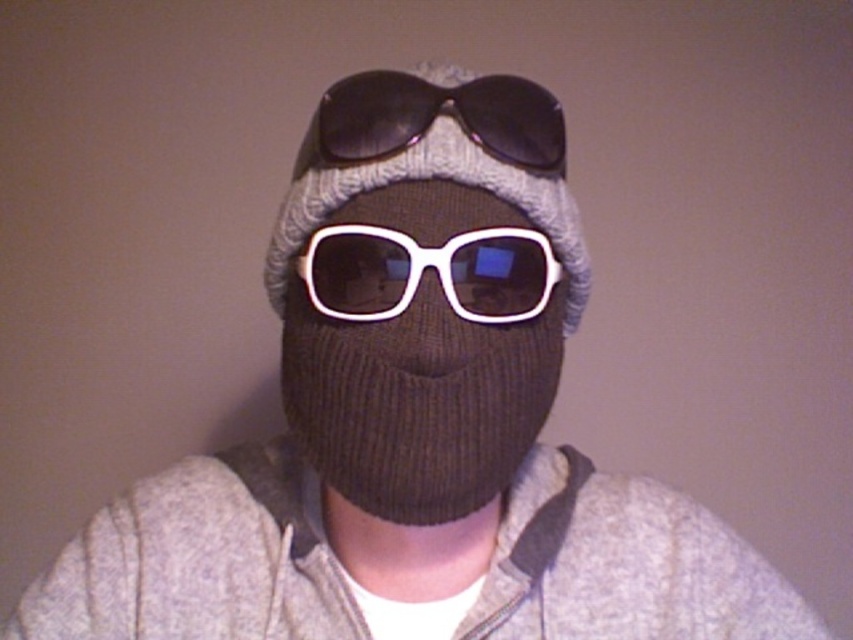
Can you confirm if sunglasses at center is positioned to the right of knitted gray hat at center?

No, sunglasses at center is not to the right of knitted gray hat at center.

Does sunglasses at center have a smaller size compared to knitted gray hat at center?

Correct, sunglasses at center occupies less space than knitted gray hat at center.

Does point (444, 90) lie in front of point (296, 204)?

Yes.

Find the location of a particular element. The width and height of the screenshot is (853, 640). sunglasses at center is located at coordinates (433, 120).

Find the location of `white matte sunglasses at center`. white matte sunglasses at center is located at coordinates (416, 403).

Based on the photo, which of these two, white matte sunglasses at center or knitted gray hat at center, stands taller?

With more height is white matte sunglasses at center.

Is point (310, 353) positioned behind point (560, 209)?

That is False.

The height and width of the screenshot is (640, 853). Identify the location of white matte sunglasses at center. (416, 403).

Which is behind, point (378, 305) or point (405, 140)?

Point (405, 140)

What do you see at coordinates (425, 269) in the screenshot? I see `white plastic sunglasses at center` at bounding box center [425, 269].

The width and height of the screenshot is (853, 640). I want to click on white plastic sunglasses at center, so click(425, 269).